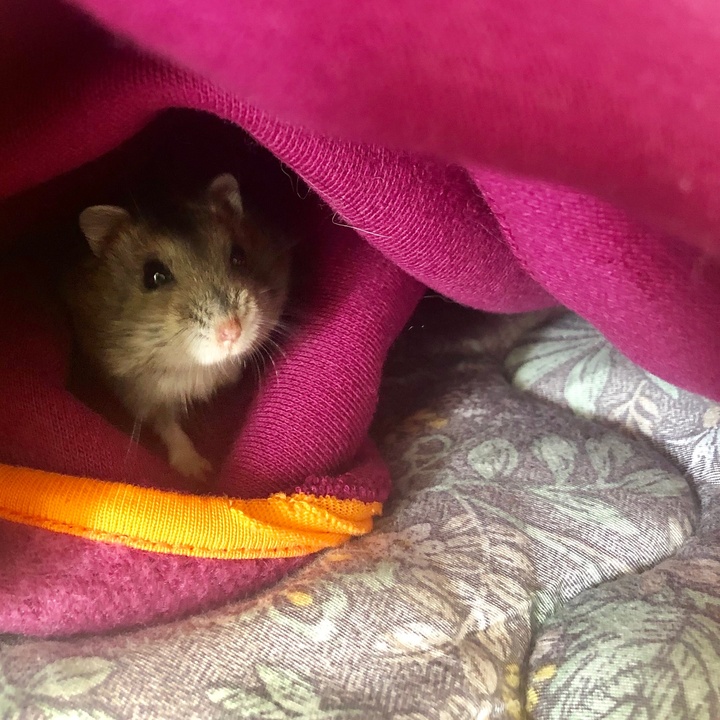
The image size is (720, 720). What are the coordinates of `dark inside of blanket hole` in the screenshot? It's located at (155, 165), (45, 248).